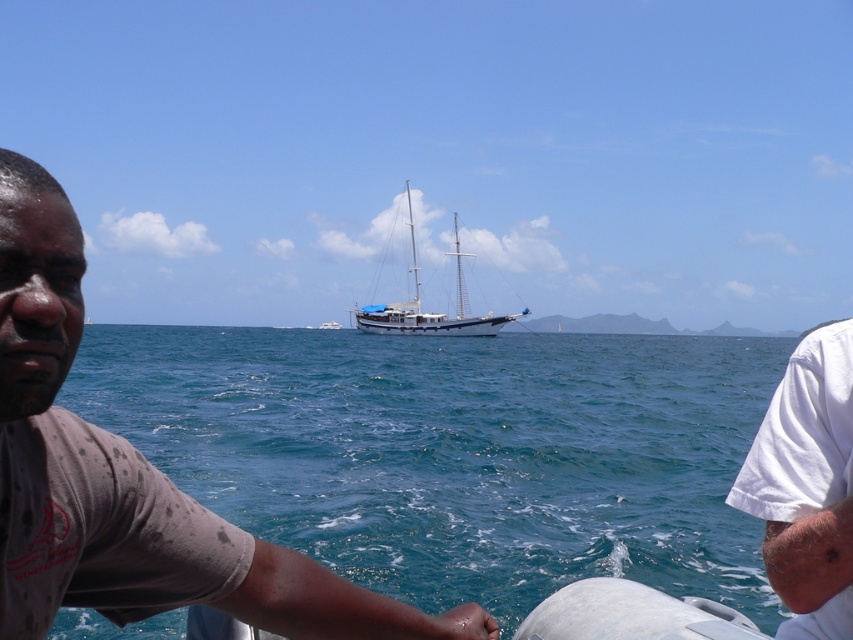
Does brown cotton shirt at left have a greater width compared to blue matte sailboat at center?

Incorrect, brown cotton shirt at left's width does not surpass blue matte sailboat at center's.

Between point (68, 282) and point (419, 333), which one is positioned behind?

The point (419, 333) is more distant.

Describe the element at coordinates (135, 480) in the screenshot. I see `brown cotton shirt at left` at that location.

At what (x,y) coordinates should I click in order to perform the action: click on brown cotton shirt at left. Please return your answer as a coordinate pair (x, y). This screenshot has height=640, width=853. Looking at the image, I should click on pyautogui.click(x=135, y=480).

Is blue water at center above blue matte sailboat at center?

Actually, blue water at center is below blue matte sailboat at center.

Is point (766, 404) in front of point (416, 326)?

Yes, it is in front of point (416, 326).

Does point (329, 550) come in front of point (363, 321)?

Yes, point (329, 550) is closer to viewer.

Find the location of a particular element. The width and height of the screenshot is (853, 640). blue water at center is located at coordinates (456, 452).

Does blue water at center appear over white cotton shirt at right?

No.

Locate an element on the screen. blue water at center is located at coordinates (456, 452).